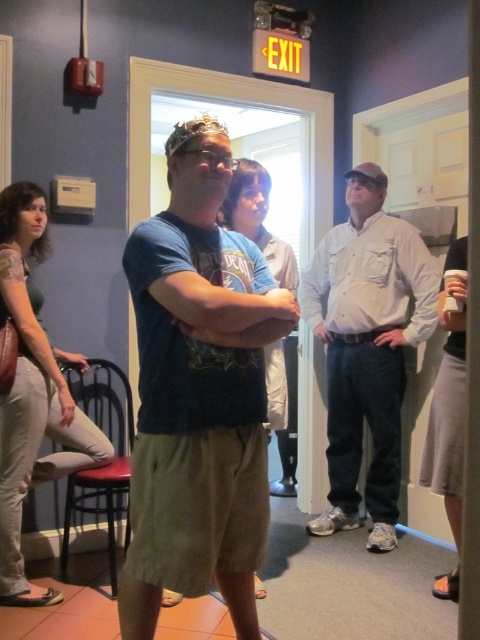
Is matte blue t-shirt at center taller than gold metallic tiara at center?

Yes.

Who is shorter, matte blue t-shirt at center or gold metallic tiara at center?

gold metallic tiara at center

Is point (188, 456) farther from viewer compared to point (184, 141)?

No, it is in front of (184, 141).

Where is `matte blue t-shirt at center`? matte blue t-shirt at center is located at coordinates (199, 397).

Is light beige shirt at center to the right of matte green shirt at center from the viewer's perspective?

Indeed, light beige shirt at center is positioned on the right side of matte green shirt at center.

This screenshot has width=480, height=640. What do you see at coordinates (367, 348) in the screenshot? I see `light beige shirt at center` at bounding box center [367, 348].

Between point (379, 275) and point (28, 336), which one is positioned in front?

Positioned in front is point (28, 336).

Identify the location of light beige shirt at center. (367, 348).

Between matte green shirt at center and red cushioned stool at lower left, which one appears on the left side from the viewer's perspective?

From the viewer's perspective, matte green shirt at center appears more on the left side.

The image size is (480, 640). I want to click on matte green shirt at center, so click(x=33, y=392).